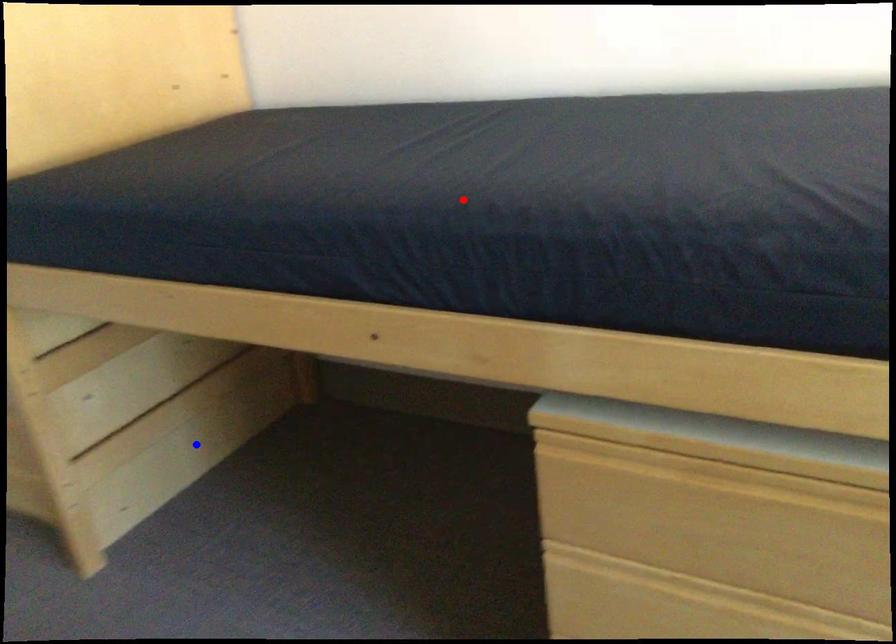
Question: In the image, two points are highlighted. Which point is nearer to the camera? Reply with the corresponding letter.

Choices:
 (A) blue point
 (B) red point

Answer: (B)